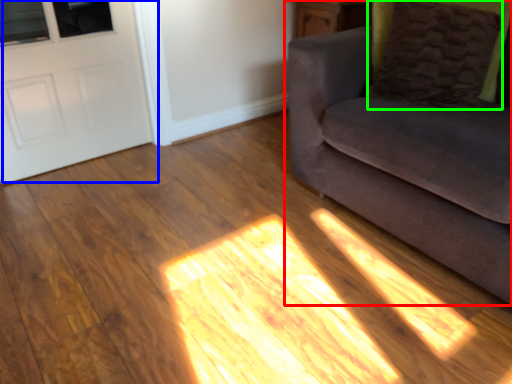
Question: Estimate the real-world distances between objects in this image. Which object is farther from studio couch (highlighted by a red box), door (highlighted by a blue box) or pillow (highlighted by a green box)?

Choices:
 (A) door
 (B) pillow

Answer: (A)